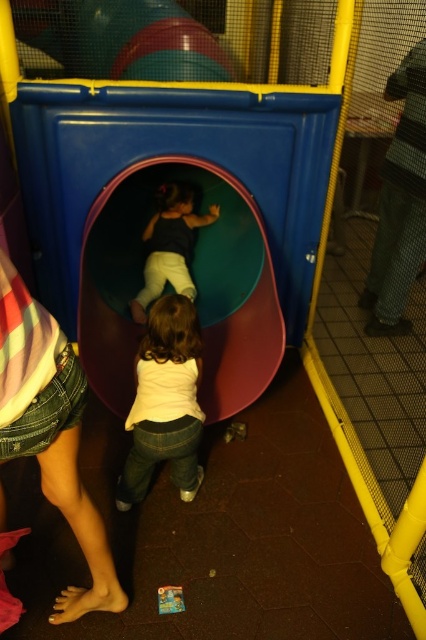
Who is lower down, white matte shirt at center or matte black shirt at center?

white matte shirt at center

Which of these two, white matte shirt at center or matte black shirt at center, stands shorter?

matte black shirt at center is shorter.

Who is more forward, (181, 330) or (149, 241)?

Point (181, 330)

The width and height of the screenshot is (426, 640). What are the coordinates of `white matte shirt at center` in the screenshot? It's located at (164, 403).

Is the position of green rubber slide at center less distant than that of denim shorts at lower left?

No, green rubber slide at center is further to the viewer.

Is green rubber slide at center behind denim shorts at lower left?

Yes, it is.

Describe the element at coordinates (193, 280) in the screenshot. I see `green rubber slide at center` at that location.

Find the location of a particular element. The image size is (426, 640). green rubber slide at center is located at coordinates (193, 280).

Can you confirm if green rubber slide at center is positioned to the left of white matte shirt at center?

Correct, you'll find green rubber slide at center to the left of white matte shirt at center.

Who is more forward, (x=207, y=300) or (x=161, y=452)?

Point (x=161, y=452) is more forward.

Does point (267, 355) lie behind point (140, 452)?

Yes, point (267, 355) is farther from viewer.

Locate an element on the screen. Image resolution: width=426 pixels, height=640 pixels. green rubber slide at center is located at coordinates (193, 280).